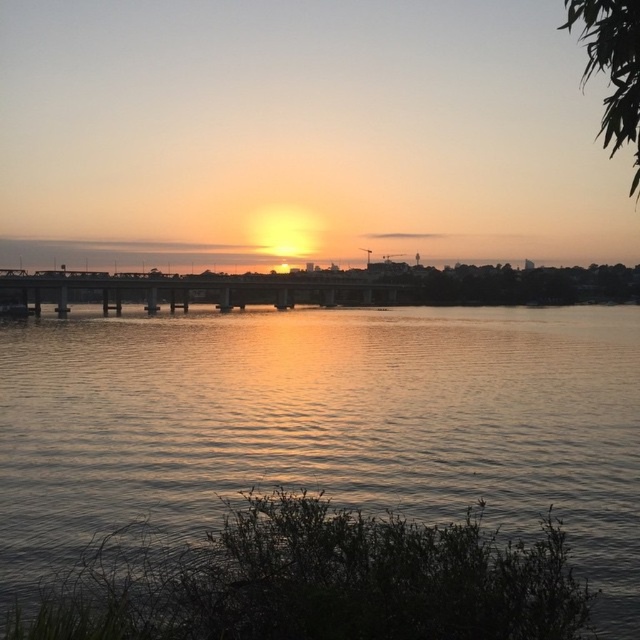
Can you confirm if silvery reflective water at center is shorter than metallic bridge at center?

Yes, silvery reflective water at center is shorter than metallic bridge at center.

Between silvery reflective water at center and metallic bridge at center, which one is positioned higher?

metallic bridge at center is above.

Between point (515, 356) and point (8, 289), which one is positioned in front?

Point (515, 356) is more forward.

This screenshot has height=640, width=640. I want to click on silvery reflective water at center, so click(x=324, y=424).